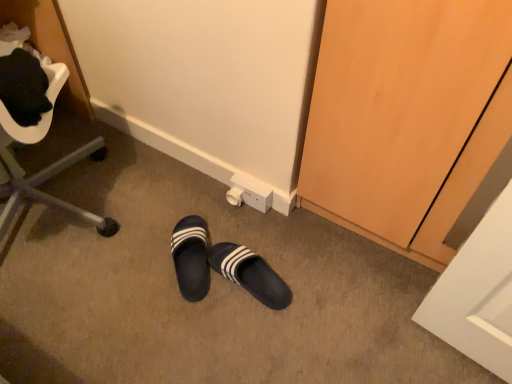
Question: Does metallic silver chair at left have a lesser width compared to black leather slippers at center?

Choices:
 (A) yes
 (B) no

Answer: (B)

Question: Does metallic silver chair at left come behind black leather slippers at center?

Choices:
 (A) no
 (B) yes

Answer: (A)

Question: From the image's perspective, is metallic silver chair at left on top of black leather slippers at center?

Choices:
 (A) no
 (B) yes

Answer: (B)

Question: Is metallic silver chair at left positioned far away from black leather slippers at center?

Choices:
 (A) no
 (B) yes

Answer: (A)

Question: Is black leather slippers at center inside metallic silver chair at left?

Choices:
 (A) yes
 (B) no

Answer: (B)

Question: Considering the relative positions of black rubber slippers at center and black leather slippers at center in the image provided, is black rubber slippers at center to the left or to the right of black leather slippers at center?

Choices:
 (A) right
 (B) left

Answer: (B)

Question: Considering their positions, is black rubber slippers at center located in front of or behind black leather slippers at center?

Choices:
 (A) front
 (B) behind

Answer: (B)

Question: From a real-world perspective, is black rubber slippers at center positioned above or below black leather slippers at center?

Choices:
 (A) above
 (B) below

Answer: (B)

Question: In terms of height, does black rubber slippers at center look taller or shorter compared to black leather slippers at center?

Choices:
 (A) tall
 (B) short

Answer: (B)

Question: Does point (194, 271) appear closer or farther from the camera than point (178, 221)?

Choices:
 (A) closer
 (B) farther

Answer: (A)

Question: Looking at the image, does black leather slippers at center seem bigger or smaller compared to black rubber slippers at center?

Choices:
 (A) big
 (B) small

Answer: (B)

Question: Considering their positions, is black leather slippers at center located in front of or behind black rubber slippers at center?

Choices:
 (A) behind
 (B) front

Answer: (B)

Question: Is black leather slippers at center wider or thinner than black rubber slippers at center?

Choices:
 (A) thin
 (B) wide

Answer: (A)

Question: In terms of height, does metallic silver chair at left look taller or shorter compared to black rubber slippers at center?

Choices:
 (A) tall
 (B) short

Answer: (A)

Question: Is metallic silver chair at left in front of or behind black rubber slippers at center in the image?

Choices:
 (A) front
 (B) behind

Answer: (A)